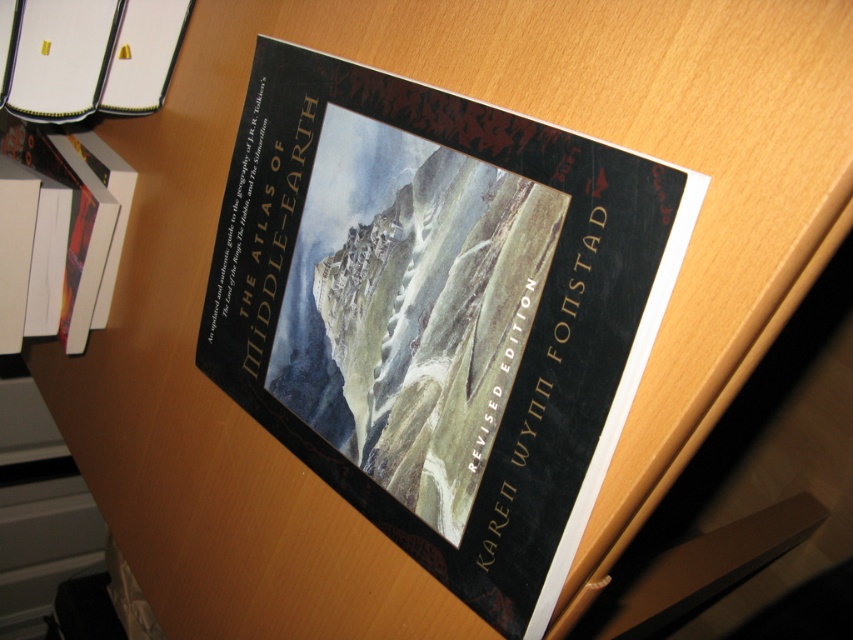
Does hardcover book at center come in front of hardcover book at upper left?

That is True.

Is hardcover book at center smaller than hardcover book at upper left?

No.

Between point (593, 326) and point (53, 40), which one is positioned in front?

Positioned in front is point (593, 326).

Locate an element on the screen. hardcover book at center is located at coordinates (439, 312).

Can you confirm if hardcover book at upper left is taller than white paper at left?

No, hardcover book at upper left is not taller than white paper at left.

Is hardcover book at upper left bigger than white paper at left?

Actually, hardcover book at upper left might be smaller than white paper at left.

I want to click on hardcover book at upper left, so click(x=90, y=56).

Where is `hardcover book at upper left`? The image size is (853, 640). hardcover book at upper left is located at coordinates (90, 56).

Does point (488, 474) lie behind point (41, 144)?

No, (488, 474) is closer to viewer.

Is hardcover book at center taller than white paper at left?

Indeed, hardcover book at center has a greater height compared to white paper at left.

Which is behind, point (523, 364) or point (103, 180)?

Positioned behind is point (103, 180).

Locate an element on the screen. This screenshot has width=853, height=640. hardcover book at center is located at coordinates (439, 312).